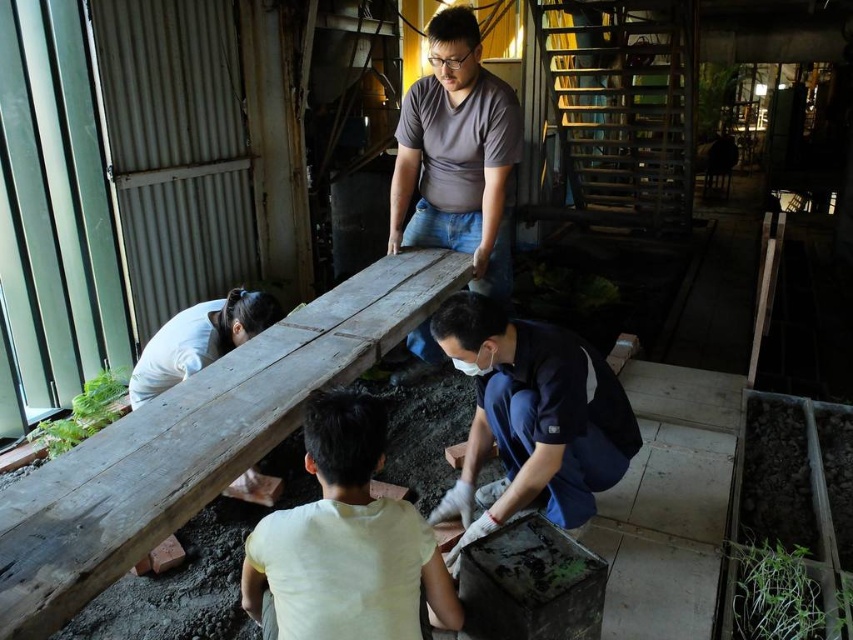
You are a safety inspector in the workshop. You need to ensure that the green leafy plant at left is placed away from the weathered wood beam at center to prevent any accidental damage. Based on their sizes, can the plant be positioned to the side without overlapping the beam?

The weathered wood beam at center is wider than the green leafy plant at left, so the plant can be positioned to the side without overlapping the beam as there is enough space.

You are standing at the origin point in the workshop. You see two points marked in the scene. Which point is closer to you, point (361, 316) or point (91, 390)?

Point (361, 316) is in front of point (91, 390), so it is closer to you.